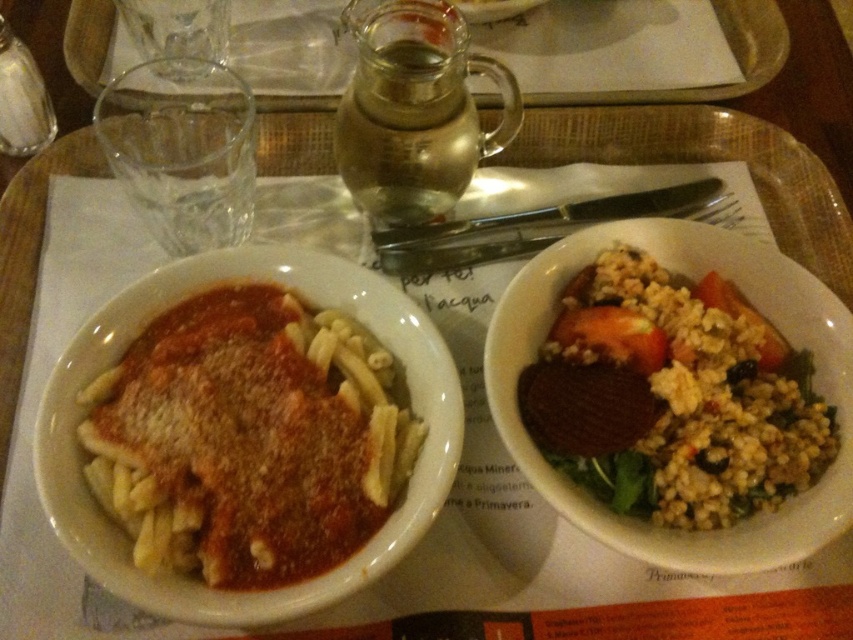
Question: Among these points, which one is farthest from the camera?

Choices:
 (A) (712, 444)
 (B) (245, 426)
 (C) (97, 52)

Answer: (C)

Question: Which point is closer to the camera?

Choices:
 (A) (631, 314)
 (B) (683, 99)
 (C) (93, 438)

Answer: (C)

Question: Does brown crumbly grain at right have a greater width compared to clear glass pitcher at upper center?

Choices:
 (A) yes
 (B) no

Answer: (B)

Question: Can you confirm if white matte pasta at center is positioned below brown crumbly grain at right?

Choices:
 (A) yes
 (B) no

Answer: (A)

Question: Is white matte pasta at center positioned at the back of brown crumbly grain at right?

Choices:
 (A) no
 (B) yes

Answer: (A)

Question: Which object is farther from the camera taking this photo?

Choices:
 (A) clear glass pitcher at upper center
 (B) brown crumbly grain at right

Answer: (A)